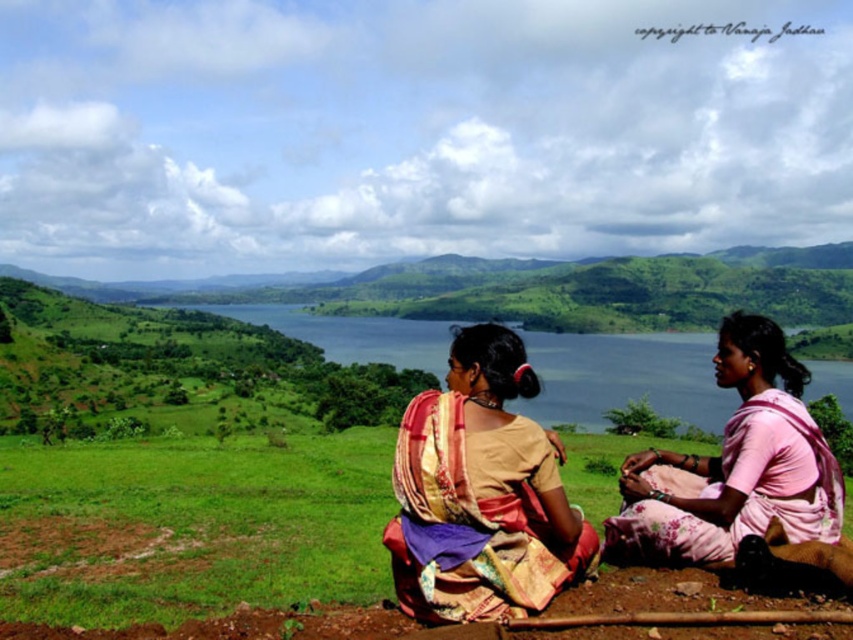
Based on the scene description, which object is taller between the multicolored silk saree at center and the pink satin saree at lower right?

The multicolored silk saree at center is taller than the pink satin saree at lower right according to the description.